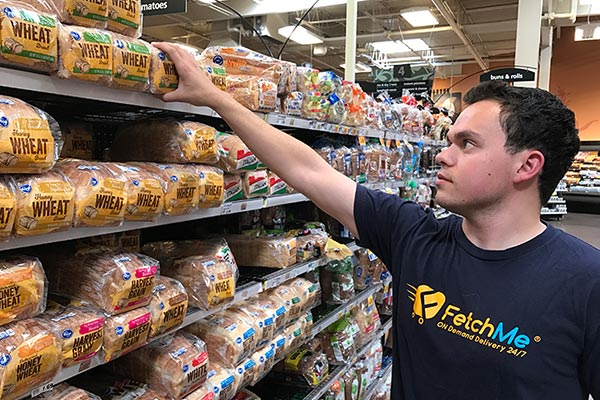
You are a GUI agent. You are given a task and a screenshot of the screen. Output one action in this format:
    pyautogui.click(x=<x>, y=<y>)
    Task: Click on the flooring
    The image size is (600, 400).
    Given the screenshot: What is the action you would take?
    pyautogui.click(x=588, y=225)